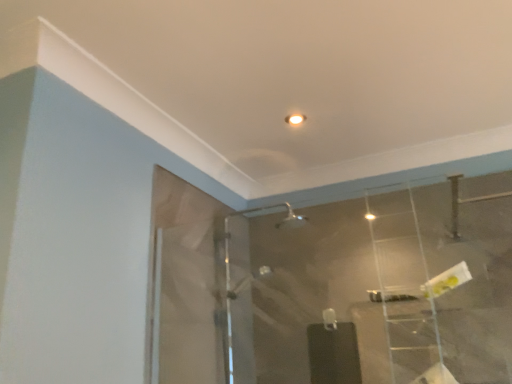
Locate an element on the screen. Image resolution: width=512 pixels, height=384 pixels. transparent glass mirror at center is located at coordinates (377, 288).

The width and height of the screenshot is (512, 384). What do you see at coordinates (377, 288) in the screenshot? I see `transparent glass mirror at center` at bounding box center [377, 288].

The image size is (512, 384). Find the location of `clear plastic ladder at upper right`. clear plastic ladder at upper right is located at coordinates (404, 289).

Describe the element at coordinates (404, 289) in the screenshot. I see `clear plastic ladder at upper right` at that location.

Identify the location of transparent glass mirror at center. Image resolution: width=512 pixels, height=384 pixels. point(377,288).

Would you say clear plastic ladder at upper right is to the left or to the right of transparent glass mirror at center in the picture?

In the image, clear plastic ladder at upper right appears on the right side of transparent glass mirror at center.

Which is behind, clear plastic ladder at upper right or transparent glass mirror at center?

clear plastic ladder at upper right is behind.

Does point (431, 333) come behind point (486, 182)?

No.

From the image's perspective, relative to transparent glass mirror at center, is clear plastic ladder at upper right above or below?

clear plastic ladder at upper right is situated higher than transparent glass mirror at center in the image.

From a real-world perspective, is clear plastic ladder at upper right above or below transparent glass mirror at center?

clear plastic ladder at upper right is situated higher than transparent glass mirror at center in the real world.

Considering the sizes of objects clear plastic ladder at upper right and transparent glass mirror at center in the image provided, who is wider, clear plastic ladder at upper right or transparent glass mirror at center?

clear plastic ladder at upper right.

Between clear plastic ladder at upper right and transparent glass mirror at center, which one has more height?

clear plastic ladder at upper right is taller.

Is clear plastic ladder at upper right bigger or smaller than transparent glass mirror at center?

Clearly, clear plastic ladder at upper right is larger in size than transparent glass mirror at center.

Is transparent glass mirror at center located within clear plastic ladder at upper right?

No.

Is clear plastic ladder at upper right next to transparent glass mirror at center?

There is a gap between clear plastic ladder at upper right and transparent glass mirror at center.

Is clear plastic ladder at upper right oriented towards transparent glass mirror at center?

Yes, clear plastic ladder at upper right is facing transparent glass mirror at center.

From the picture: Can you tell me how much clear plastic ladder at upper right and transparent glass mirror at center differ in facing direction?

The facing directions of clear plastic ladder at upper right and transparent glass mirror at center are 179 degrees apart.

Identify the location of ladder behind the transparent glass mirror at center. (404, 289).

Is transparent glass mirror at center at the left side of clear plastic ladder at upper right?

Indeed, transparent glass mirror at center is positioned on the left side of clear plastic ladder at upper right.

Relative to clear plastic ladder at upper right, is transparent glass mirror at center in front or behind?

Visually, transparent glass mirror at center is located in front of clear plastic ladder at upper right.

Is point (398, 338) closer to viewer compared to point (433, 333)?

No, it is behind (433, 333).

From the image's perspective, is transparent glass mirror at center beneath clear plastic ladder at upper right?

Correct, transparent glass mirror at center appears lower than clear plastic ladder at upper right in the image.

From a real-world perspective, is transparent glass mirror at center positioned above or below clear plastic ladder at upper right?

transparent glass mirror at center is below clear plastic ladder at upper right.

Which object is thinner, transparent glass mirror at center or clear plastic ladder at upper right?

transparent glass mirror at center is thinner.

Can you confirm if transparent glass mirror at center is shorter than clear plastic ladder at upper right?

Correct, transparent glass mirror at center is not as tall as clear plastic ladder at upper right.

Looking at the image, does transparent glass mirror at center seem bigger or smaller compared to clear plastic ladder at upper right?

Considering their sizes, transparent glass mirror at center takes up less space than clear plastic ladder at upper right.

Choose the correct answer: Is transparent glass mirror at center inside clear plastic ladder at upper right or outside it?

transparent glass mirror at center is not inside clear plastic ladder at upper right, it's outside.

Are transparent glass mirror at center and clear plastic ladder at upper right located far from each other?

No, transparent glass mirror at center is not far away from clear plastic ladder at upper right.

Is clear plastic ladder at upper right at the back of transparent glass mirror at center?

Yes, transparent glass mirror at center is positioned with its back facing clear plastic ladder at upper right.

How different are the orientations of transparent glass mirror at center and clear plastic ladder at upper right in degrees?

There is a 179-degree angle between the facing directions of transparent glass mirror at center and clear plastic ladder at upper right.

Locate an element on the screen. This screenshot has width=512, height=384. ladder that appears behind the transparent glass mirror at center is located at coordinates (404, 289).

At what (x,y) coordinates should I click in order to perform the action: click on mirror that is in front of the clear plastic ladder at upper right. Please return your answer as a coordinate pair (x, y). Image resolution: width=512 pixels, height=384 pixels. Looking at the image, I should click on 377,288.

Locate an element on the screen. ladder behind the transparent glass mirror at center is located at coordinates (404, 289).